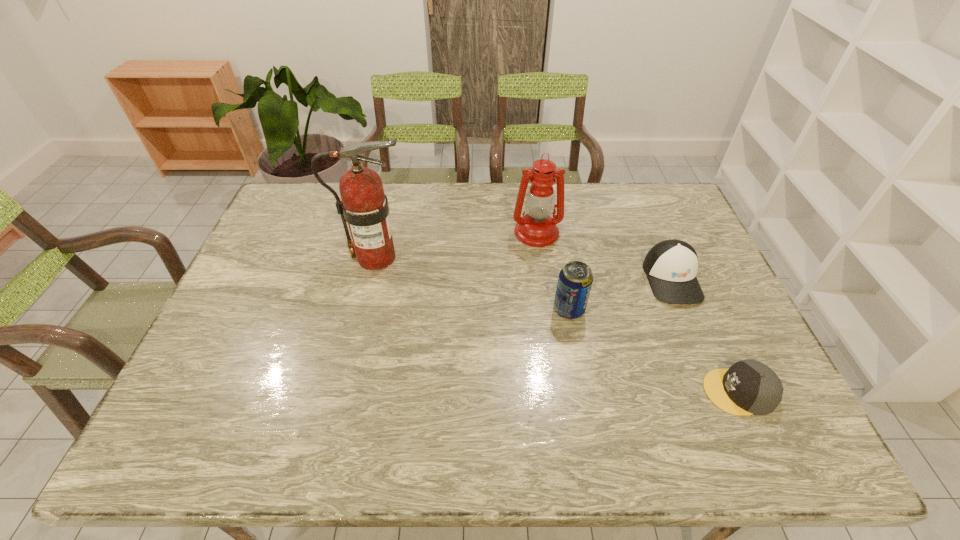
At what (x,y) coordinates should I click in order to perform the action: click on blank area located 0.200m on the left of the third tallest object. Please return your answer as a coordinate pair (x, y). Looking at the image, I should click on (481, 309).

The height and width of the screenshot is (540, 960). What are the coordinates of `vacant space located 0.380m on the front panel of the taller cap` in the screenshot? It's located at pos(739,440).

Identify the location of vacant space located on the front-facing side of the nearer cap. This screenshot has height=540, width=960. (662, 392).

Identify the location of free space located on the front-facing side of the nearer cap. (650, 392).

The width and height of the screenshot is (960, 540). What are the coordinates of `vacant space positioned 0.060m on the front-facing side of the nearer cap` in the screenshot? It's located at (680, 392).

I want to click on object that is at the far edge, so click(x=537, y=228).

I want to click on vacant area at the far edge of the desktop, so click(495, 211).

Locate an element on the screen. vacant space at the near edge of the desktop is located at coordinates (556, 422).

In the image, there is a desktop. What are the coordinates of `vacant space at the right edge` in the screenshot? It's located at (687, 240).

Locate an element on the screen. vacant point at the far left corner is located at coordinates (292, 197).